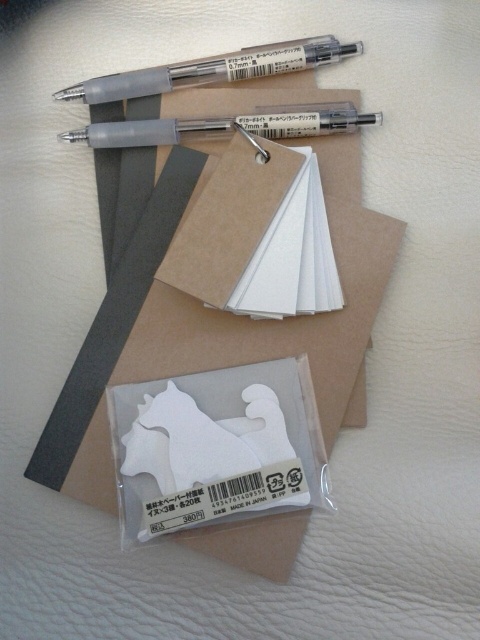
Is transparent plastic pen at upper center closer to the viewer compared to matte gray pen at upper center?

No, transparent plastic pen at upper center is behind matte gray pen at upper center.

Can you confirm if transparent plastic pen at upper center is thinner than matte gray pen at upper center?

Yes.

Image resolution: width=480 pixels, height=640 pixels. In order to click on transparent plastic pen at upper center in this screenshot , I will do `click(213, 68)`.